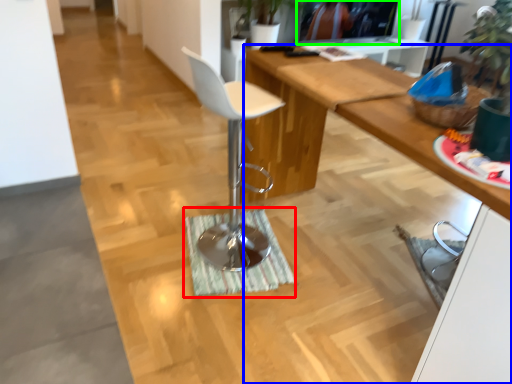
Question: Which object is positioned farthest from doormat (highlighted by a red box)? Select from desk (highlighted by a blue box) and television (highlighted by a green box).

Choices:
 (A) desk
 (B) television

Answer: (B)